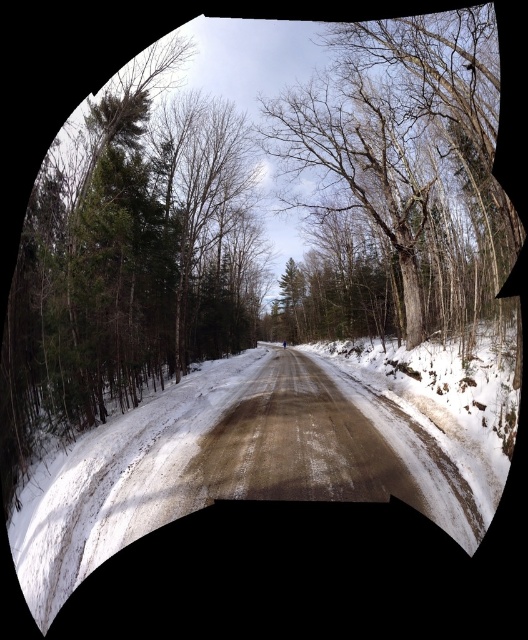
You are driving a car and see the white powdery snow at center and the bare wood tree at center ahead on the road. Which object is closer to the left side of the road?

The white powdery snow at center is to the left of the bare wood tree at center, so it is closer to the left side of the road.

You are a snowmobile rider planning to cross the white powdery snow at center. Your snowmobile requires at least 12 feet of clear space to safely accelerate. Based on the scene, can you determine if there is enough space available?

The distance between the white powdery snow at center and the camera is 13.50 feet, which is more than the required 12 feet. Therefore, there is sufficient space for the snowmobile to safely accelerate.

Consider the image. You are driving a car along the rural road in the winter scene. There are two points marked on the road ahead. The first point is at coordinate point (371, 371) and the second is at point (340, 22). As you drive forward, which point will you encounter first?

Point (340, 22) will be encountered first because it is in front of point (371, 371) based on their positions along the road.